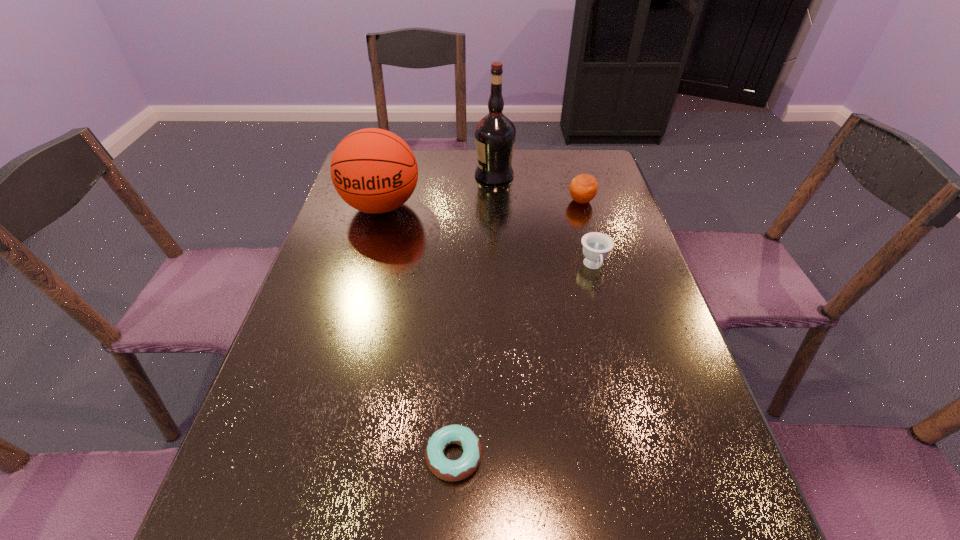
Image resolution: width=960 pixels, height=540 pixels. I want to click on vacant area that lies between the second tallest object and the third tallest object, so pyautogui.click(x=481, y=204).

Find the location of `vacant space that's between the second nearest object and the nearest object`. vacant space that's between the second nearest object and the nearest object is located at coordinates (524, 361).

The height and width of the screenshot is (540, 960). I want to click on free space that is in between the tallest object and the leftmost object, so click(x=438, y=191).

Where is `free space that is in between the nearest object and the liquor`? free space that is in between the nearest object and the liquor is located at coordinates (474, 315).

This screenshot has height=540, width=960. I want to click on object that ranks as the closest to the orange, so click(495, 134).

Locate an element on the screen. object that is the second nearest to the basketball is located at coordinates (596, 246).

The width and height of the screenshot is (960, 540). Identify the location of free space that satisfies the following two spatial constraints: 1. on the back side of the nearest object; 2. on the left side of the third shortest object. click(465, 201).

Locate an element on the screen. The image size is (960, 540). free space that satisfies the following two spatial constraints: 1. on the surface of the tallest object; 2. on the front side of the shortest object is located at coordinates [x=507, y=456].

Where is `vacant space that satisfies the following two spatial constraints: 1. on the surface of the orange; 2. on the right side of the liquor`? vacant space that satisfies the following two spatial constraints: 1. on the surface of the orange; 2. on the right side of the liquor is located at coordinates (495, 201).

Find the location of a particular element. free space that satisfies the following two spatial constraints: 1. on the back side of the orange; 2. on the surface of the liquor is located at coordinates (573, 175).